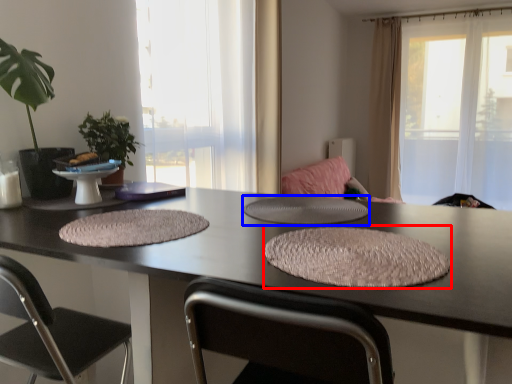
Question: Which object appears farthest to the camera in this image, yoga mat (highlighted by a red box) or round table (highlighted by a blue box)?

Choices:
 (A) yoga mat
 (B) round table

Answer: (B)